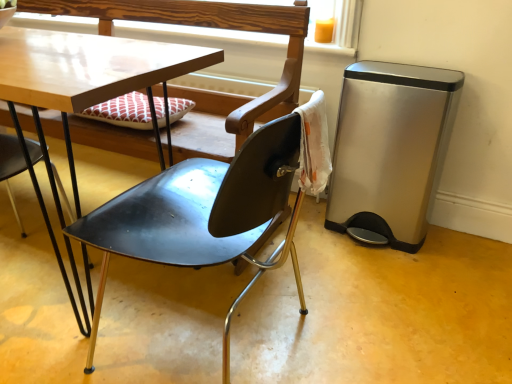
Question: Is wooden at upper center bigger than matte black chair at center, which is counted as the 2th chair, starting from the left?

Choices:
 (A) no
 (B) yes

Answer: (A)

Question: From the image's perspective, is wooden at upper center under matte black chair at center, arranged as the first chair when viewed from the right?

Choices:
 (A) no
 (B) yes

Answer: (A)

Question: Can you confirm if wooden at upper center is wider than matte black chair at center, arranged as the first chair when viewed from the right?

Choices:
 (A) yes
 (B) no

Answer: (B)

Question: Considering the relative sizes of wooden at upper center and matte black chair at center, arranged as the first chair when viewed from the right, in the image provided, is wooden at upper center shorter than matte black chair at center, arranged as the first chair when viewed from the right,?

Choices:
 (A) yes
 (B) no

Answer: (A)

Question: Considering the relative positions of wooden at upper center and matte black chair at center, arranged as the first chair when viewed from the right, in the image provided, is wooden at upper center behind matte black chair at center, arranged as the first chair when viewed from the right,?

Choices:
 (A) yes
 (B) no

Answer: (A)

Question: Considering their positions, is matte black chair at center, arranged as the first chair when viewed from the right, located in front of or behind satin silver trash can at right?

Choices:
 (A) front
 (B) behind

Answer: (A)

Question: Based on their sizes in the image, would you say matte black chair at center, which is counted as the 2th chair, starting from the left, is bigger or smaller than satin silver trash can at right?

Choices:
 (A) big
 (B) small

Answer: (A)

Question: From a real-world perspective, is matte black chair at center, arranged as the first chair when viewed from the right, above or below satin silver trash can at right?

Choices:
 (A) below
 (B) above

Answer: (B)

Question: Considering the positions of matte black chair at center, which is counted as the 2th chair, starting from the left, and satin silver trash can at right in the image, is matte black chair at center, which is counted as the 2th chair, starting from the left, wider or thinner than satin silver trash can at right?

Choices:
 (A) wide
 (B) thin

Answer: (A)

Question: Considering the positions of satin silver trash can at right and wooden at upper center in the image, is satin silver trash can at right taller or shorter than wooden at upper center?

Choices:
 (A) short
 (B) tall

Answer: (B)

Question: From a real-world perspective, relative to wooden at upper center, is satin silver trash can at right vertically above or below?

Choices:
 (A) below
 (B) above

Answer: (A)

Question: Is satin silver trash can at right wider or thinner than wooden at upper center?

Choices:
 (A) wide
 (B) thin

Answer: (A)

Question: Would you say satin silver trash can at right is inside or outside wooden at upper center?

Choices:
 (A) outside
 (B) inside

Answer: (A)

Question: Do you think black metal chair at lower left, which appears as the 1th chair when viewed from the left, is within wooden at upper center, or outside of it?

Choices:
 (A) inside
 (B) outside

Answer: (B)

Question: Is point (19, 155) closer or farther from the camera than point (90, 23)?

Choices:
 (A) closer
 (B) farther

Answer: (A)